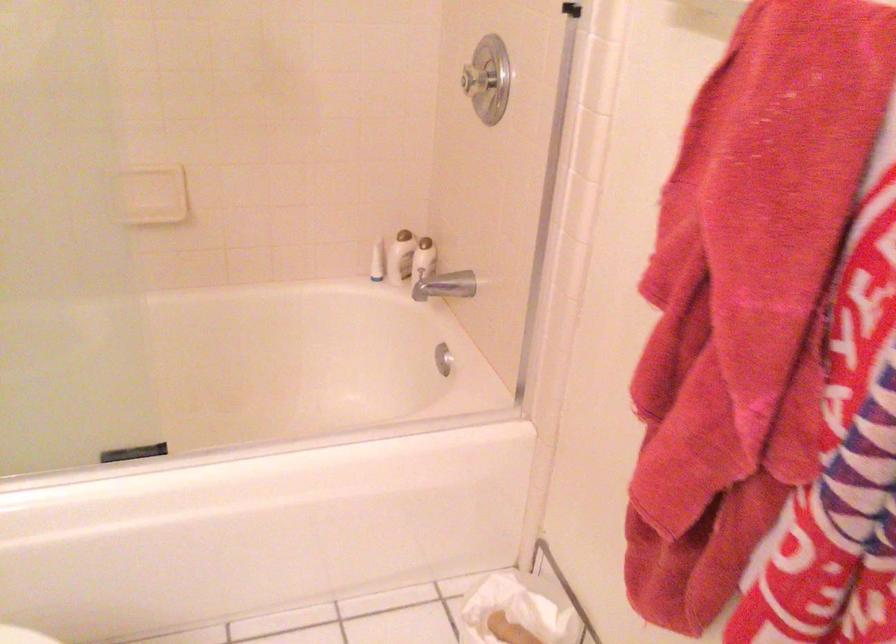
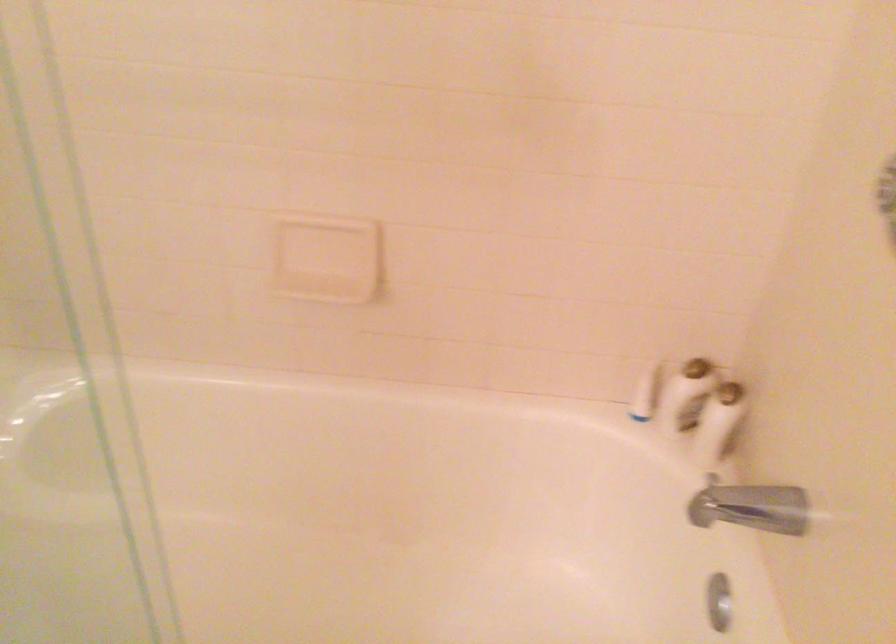
Where in the second image is the point corresponding to point (376, 261) from the first image?

(644, 393)